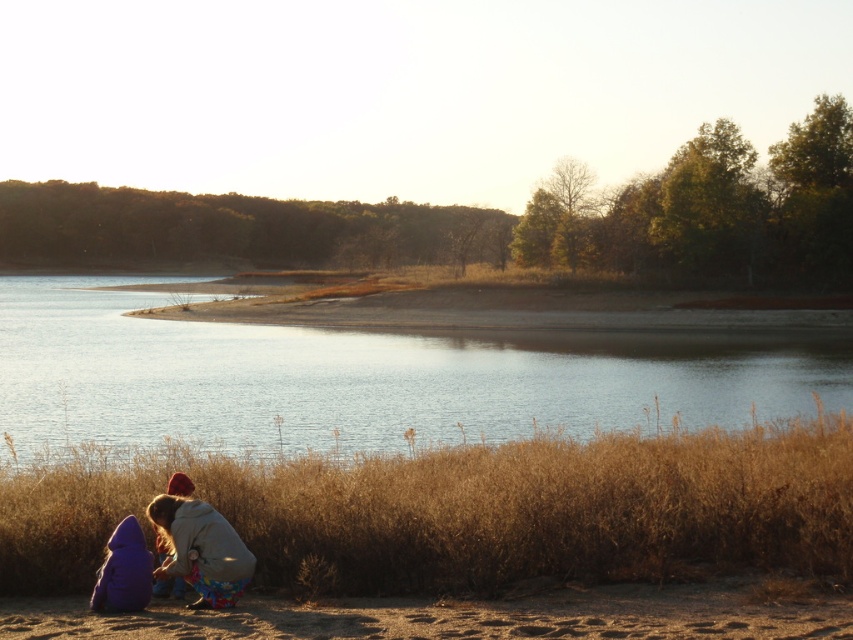
Question: Which point appears farthest from the camera in this image?

Choices:
 (A) (550, 600)
 (B) (192, 538)
 (C) (703, 388)

Answer: (C)

Question: Does clear blue water at center have a smaller size compared to purple fleece jacket at lower left?

Choices:
 (A) yes
 (B) no

Answer: (B)

Question: Does clear blue water at center come in front of brown sandy ground at lower left?

Choices:
 (A) no
 (B) yes

Answer: (A)

Question: Based on their relative distances, which object is nearer to the brown sandy ground at lower left?

Choices:
 (A) purple fleece jacket at lower left
 (B) clear blue water at center

Answer: (A)

Question: Can you confirm if clear blue water at center is positioned to the left of brown sandy ground at lower left?

Choices:
 (A) no
 (B) yes

Answer: (B)

Question: Considering the real-world distances, which object is closest to the clear blue water at center?

Choices:
 (A) brown sandy ground at lower left
 (B) purple fleece jacket at lower left

Answer: (B)